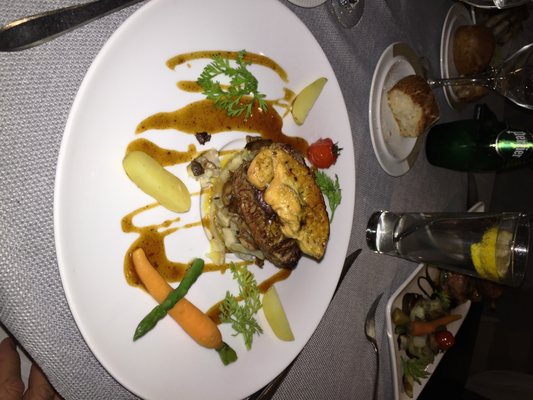
You are a GUI agent. You are given a task and a screenshot of the screen. Output one action in this format:
    pyautogui.click(x=<x>, y=<y>)
    Task: Click on the fork
    
    Given the screenshot: What is the action you would take?
    pyautogui.click(x=370, y=331)